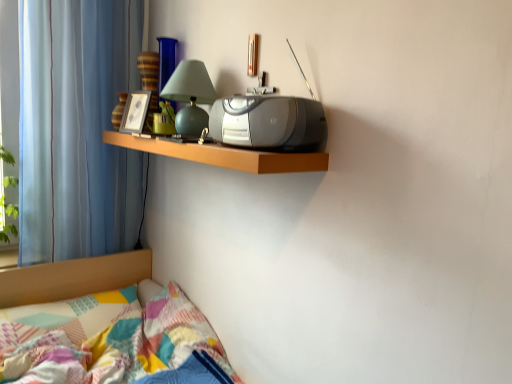
What do you see at coordinates (224, 155) in the screenshot? I see `wooden shelf at upper center` at bounding box center [224, 155].

Where is `wooden shelf at upper center`? The image size is (512, 384). wooden shelf at upper center is located at coordinates (224, 155).

Are matte green glass table lamp at upper center and satin silver stereo at center making contact?

No.

How many degrees apart are the facing directions of matte green glass table lamp at upper center and satin silver stereo at center?

There is a 2.13-degree angle between the facing directions of matte green glass table lamp at upper center and satin silver stereo at center.

Is satin silver stereo at center at the back of matte green glass table lamp at upper center?

No.

Does point (181, 111) appear closer or farther from the camera than point (214, 136)?

Point (181, 111) is positioned farther from the camera compared to point (214, 136).

Is satin silver stereo at center beside wooden shelf at upper center?

No, satin silver stereo at center is not in contact with wooden shelf at upper center.

Visually, is satin silver stereo at center positioned to the left or to the right of wooden shelf at upper center?

In the image, satin silver stereo at center appears on the right side of wooden shelf at upper center.

From a real-world perspective, which is physically below, satin silver stereo at center or wooden shelf at upper center?

wooden shelf at upper center, from a real-world perspective.

Between satin silver stereo at center and wooden shelf at upper center, which one has larger width?

wooden shelf at upper center is wider.

From the image's perspective, which one is positioned lower, blue striped curtain at left or matte green glass table lamp at upper center?

blue striped curtain at left, from the image's perspective.

Is blue striped curtain at left far from matte green glass table lamp at upper center?

No.

Is blue striped curtain at left in front of or behind matte green glass table lamp at upper center in the image?

Visually, blue striped curtain at left is located behind matte green glass table lamp at upper center.

Can we say blue striped curtain at left lies outside matte green glass table lamp at upper center?

blue striped curtain at left is positioned outside matte green glass table lamp at upper center.

Based on the photo, is matte green glass table lamp at upper center directly adjacent to patchwork fabric bed at lower left?

matte green glass table lamp at upper center is not next to patchwork fabric bed at lower left, and they're not touching.

Is matte green glass table lamp at upper center facing towards patchwork fabric bed at lower left?

No, matte green glass table lamp at upper center is not aimed at patchwork fabric bed at lower left.

Which object is more forward, matte green glass table lamp at upper center or patchwork fabric bed at lower left?

patchwork fabric bed at lower left is in front.

Consider the image. From the image's perspective, which one is positioned lower, matte green glass table lamp at upper center or patchwork fabric bed at lower left?

From the image's view, patchwork fabric bed at lower left is below.

From the image's perspective, which object appears higher, matte green glass table lamp at upper center or wooden shelf at upper center?

From the image's view, matte green glass table lamp at upper center is above.

Is matte green glass table lamp at upper center far away from wooden shelf at upper center?

They are positioned close to each other.

Which object is positioned more to the left, matte green glass table lamp at upper center or wooden shelf at upper center?

Positioned to the left is matte green glass table lamp at upper center.

Are wooden shelf at upper center and matte green glass table lamp at upper center far apart?

No, wooden shelf at upper center is in close proximity to matte green glass table lamp at upper center.

Which is behind, wooden shelf at upper center or matte green glass table lamp at upper center?

Positioned behind is matte green glass table lamp at upper center.

Does satin silver stereo at center have a smaller size compared to matte green glass table lamp at upper center?

Yes.

Does satin silver stereo at center have a greater height compared to matte green glass table lamp at upper center?

Incorrect, the height of satin silver stereo at center is not larger of that of matte green glass table lamp at upper center.

Who is more distant, satin silver stereo at center or matte green glass table lamp at upper center?

Positioned behind is matte green glass table lamp at upper center.

Where is `stereo in front of the matte green glass table lamp at upper center`? This screenshot has height=384, width=512. stereo in front of the matte green glass table lamp at upper center is located at coordinates (269, 123).

Identify the location of shelf below the satin silver stereo at center (from the image's perspective). (224, 155).

From the image, which object appears to be farther from patchwork fabric bed at lower left, satin silver stereo at center or blue striped curtain at left?

satin silver stereo at center.

From the image, which object appears to be farther from wooden shelf at upper center, patchwork fabric bed at lower left or satin silver stereo at center?

Based on the image, patchwork fabric bed at lower left appears to be further to wooden shelf at upper center.

In the scene shown: Which object lies nearer to the anchor point blue striped curtain at left, wooden shelf at upper center or satin silver stereo at center?

wooden shelf at upper center is positioned closer to the anchor blue striped curtain at left.

From the picture: From the image, which object appears to be farther from wooden shelf at upper center, matte green glass table lamp at upper center or satin silver stereo at center?

matte green glass table lamp at upper center.

Looking at the image, which one is located closer to patchwork fabric bed at lower left, wooden shelf at upper center or matte green glass table lamp at upper center?

wooden shelf at upper center is closer to patchwork fabric bed at lower left.

Considering their positions, is wooden shelf at upper center positioned closer to matte green glass table lamp at upper center than blue striped curtain at left?

The object closer to matte green glass table lamp at upper center is wooden shelf at upper center.

Based on their spatial positions, is wooden shelf at upper center or blue striped curtain at left further from patchwork fabric bed at lower left?

Among the two, wooden shelf at upper center is located further to patchwork fabric bed at lower left.

From the image, which object appears to be nearer to wooden shelf at upper center, blue striped curtain at left or satin silver stereo at center?

satin silver stereo at center is closer to wooden shelf at upper center.

The image size is (512, 384). I want to click on table lamp between blue striped curtain at left and wooden shelf at upper center from left to right, so click(x=190, y=97).

Identify the location of shelf located between satin silver stereo at center and matte green glass table lamp at upper center in the depth direction. (224, 155).

This screenshot has width=512, height=384. I want to click on curtain between matte green glass table lamp at upper center and patchwork fabric bed at lower left from top to bottom, so click(x=76, y=128).

I want to click on stereo between blue striped curtain at left and patchwork fabric bed at lower left vertically, so click(269, 123).